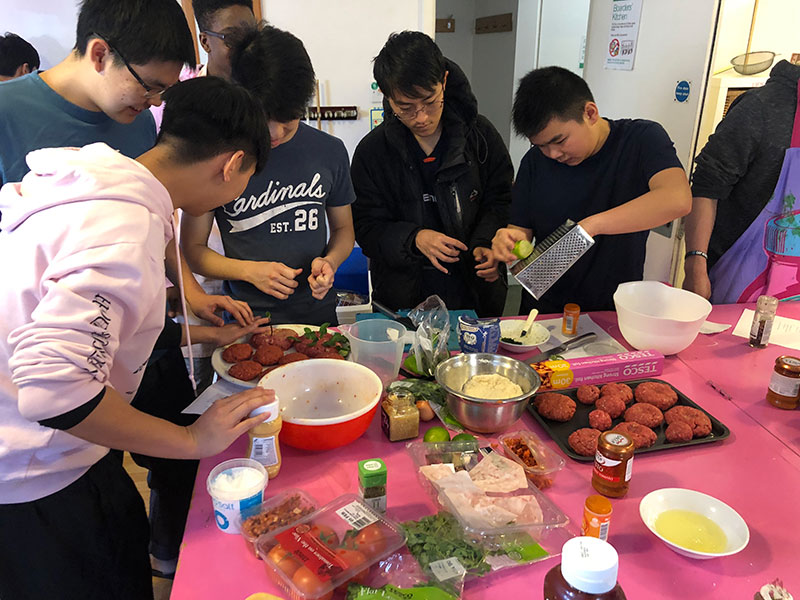
Locate an element on the screen. door is located at coordinates (677, 55).